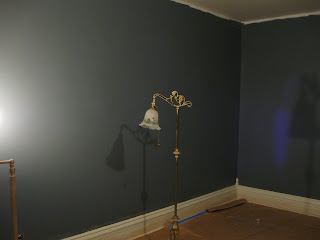
Find the location of a particular element. The image size is (320, 240). gold lamp pole is located at coordinates (177, 137).